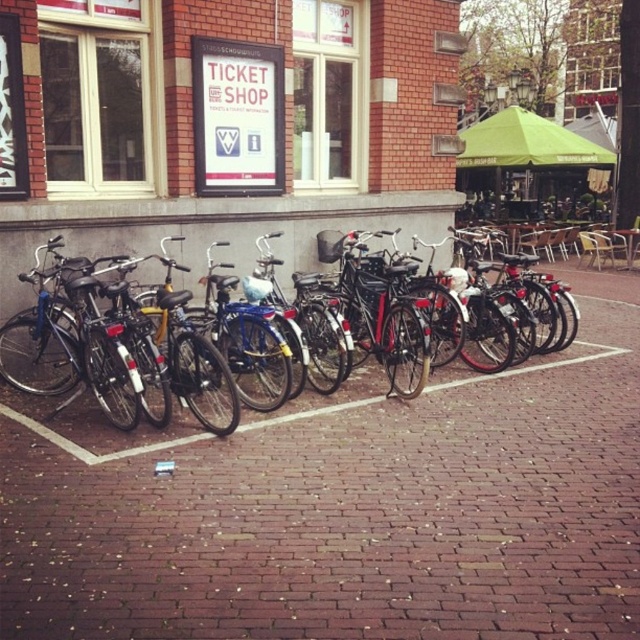
Question: From the image, what is the correct spatial relationship of brick pavement at center in relation to shiny black bicycle at center?

Choices:
 (A) below
 (B) above

Answer: (A)

Question: Among these objects, which one is farthest from the camera?

Choices:
 (A) shiny black bicycle at center
 (B) brick pavement at center

Answer: (B)

Question: Which point is farther to the camera?

Choices:
 (A) brick pavement at center
 (B) shiny black bicycle at center

Answer: (A)

Question: Does brick pavement at center have a lesser width compared to shiny black bicycle at center?

Choices:
 (A) yes
 (B) no

Answer: (A)

Question: Can you confirm if brick pavement at center is wider than shiny black bicycle at center?

Choices:
 (A) no
 (B) yes

Answer: (A)